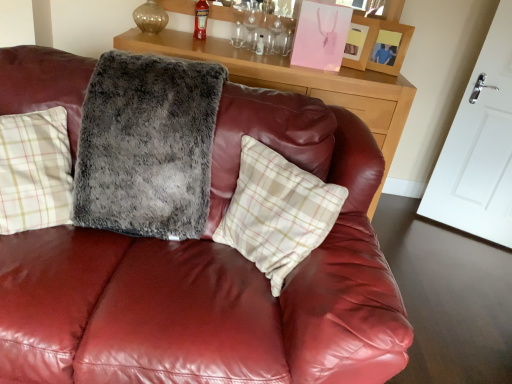
Question: Looking at their shapes, would you say matte pink picture frame at upper right, which appears as the 1th picture frame when viewed from the left, is wider or thinner than fuzzy gray blanket at center?

Choices:
 (A) thin
 (B) wide

Answer: (A)

Question: From the image's perspective, is matte pink picture frame at upper right, the 2th picture frame in the right-to-left sequence, positioned above or below fuzzy gray blanket at center?

Choices:
 (A) above
 (B) below

Answer: (A)

Question: Estimate the real-world distances between objects in this image. Which object is farther from the matte pink picture frame at upper right, which appears as the 1th picture frame when viewed from the left?

Choices:
 (A) white plaid pillow at center
 (B) wooden picture frame at upper right, the second picture frame in the left-to-right sequence
 (C) fuzzy gray blanket at center
 (D) red glass bottle at upper center
 (E) wooden cabinet at upper center

Answer: (A)

Question: Which is farther from the fuzzy gray blanket at center?

Choices:
 (A) red glass bottle at upper center
 (B) matte pink picture frame at upper right, which appears as the 1th picture frame when viewed from the left
 (C) wooden picture frame at upper right, the second picture frame in the left-to-right sequence
 (D) wooden cabinet at upper center
 (E) white plaid pillow at center

Answer: (C)